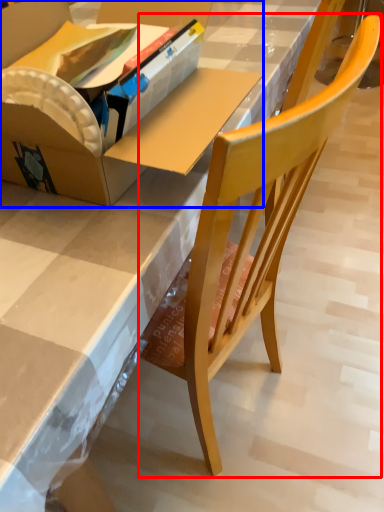
Question: Among these objects, which one is nearest to the camera, chair (highlighted by a red box) or box (highlighted by a blue box)?

Choices:
 (A) chair
 (B) box

Answer: (A)